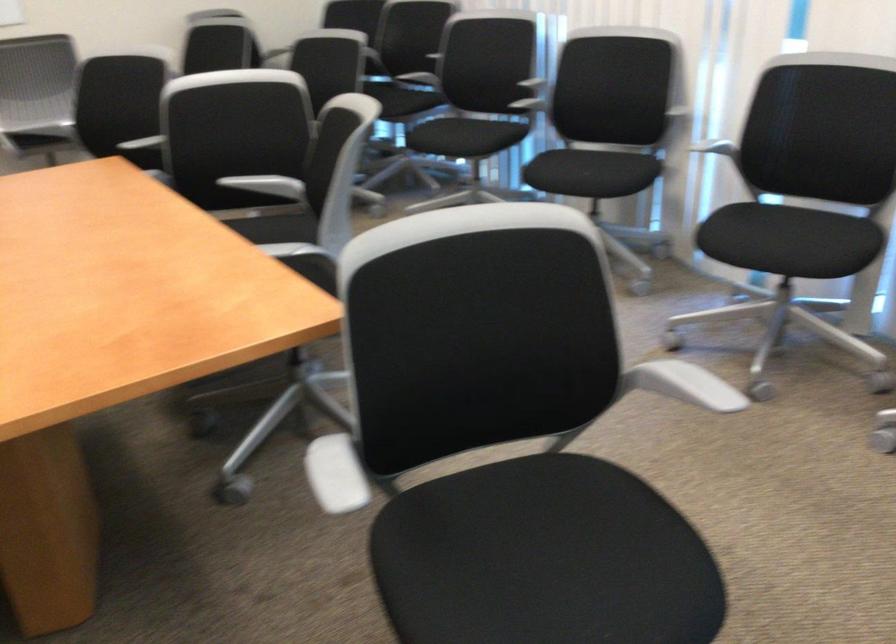
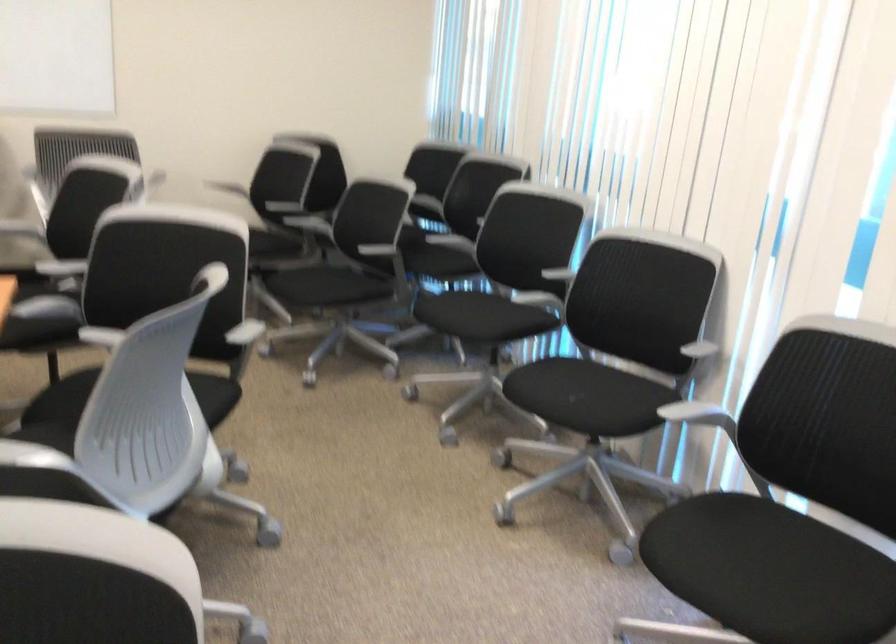
The images are taken continuously from a first-person perspective. In which direction are you moving?

The cameraman moved toward right, forward.